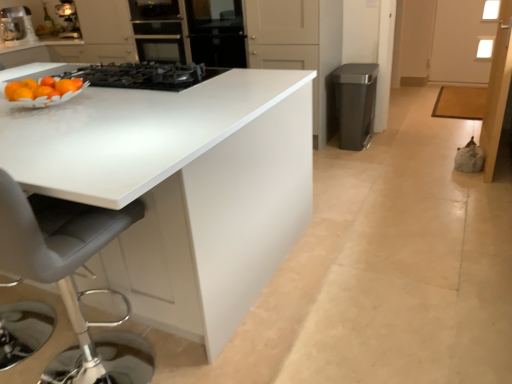
Locate an element on the screen. black matte gas stove at upper center is located at coordinates (145, 75).

Describe the element at coordinates (17, 26) in the screenshot. The height and width of the screenshot is (384, 512). I see `metallic silver coffee maker at upper left` at that location.

In order to face satin metallic trash can at right, should I rotate leftwards or rightwards?

You should rotate right by 13.041 degrees.

Find the location of a particular element. white glossy table at center is located at coordinates (180, 188).

The width and height of the screenshot is (512, 384). What do you see at coordinates (158, 30) in the screenshot?
I see `black glass oven at center` at bounding box center [158, 30].

Find the location of `gray leather swivel chair at left`. gray leather swivel chair at left is located at coordinates (68, 268).

Identify the location of black matte gas stove at upper center. This screenshot has height=384, width=512. (145, 75).

Considering the relative sizes of satin metallic trash can at right and gray leather swivel chair at left in the image provided, is satin metallic trash can at right thinner than gray leather swivel chair at left?

Yes, satin metallic trash can at right is thinner than gray leather swivel chair at left.

Is satin metallic trash can at right oriented away from gray leather swivel chair at left?

No, satin metallic trash can at right's orientation is not away from gray leather swivel chair at left.

Is satin metallic trash can at right next to gray leather swivel chair at left and touching it?

satin metallic trash can at right and gray leather swivel chair at left are clearly separated.

From a real-world perspective, who is located lower, satin metallic trash can at right or gray leather swivel chair at left?

satin metallic trash can at right.

From a real-world perspective, who is located lower, gray leather swivel chair at left or metallic silver coffee maker at upper left?

gray leather swivel chair at left.

Considering the positions of point (141, 373) and point (30, 39), is point (141, 373) closer or farther from the camera than point (30, 39)?

Clearly, point (141, 373) is closer to the camera than point (30, 39).

Based on the photo, would you say gray leather swivel chair at left is to the left or to the right of metallic silver coffee maker at upper left in the picture?

gray leather swivel chair at left is positioned on metallic silver coffee maker at upper left's right side.

Is the surface of gray leather swivel chair at left in direct contact with metallic silver coffee maker at upper left?

No, gray leather swivel chair at left is not making contact with metallic silver coffee maker at upper left.

From a real-world perspective, is black matte gas stove at upper center located beneath white glossy table at center?

No, from a real-world perspective, black matte gas stove at upper center is not under white glossy table at center.

Is black matte gas stove at upper center at the right side of white glossy table at center?

Indeed, black matte gas stove at upper center is positioned on the right side of white glossy table at center.

Consider the image. Is the surface of black matte gas stove at upper center in direct contact with white glossy table at center?

black matte gas stove at upper center is not next to white glossy table at center, and they're not touching.

Are black matte gas stove at upper center and satin metallic trash can at right far apart?

Yes, black matte gas stove at upper center and satin metallic trash can at right are quite far apart.

Is the depth of black matte gas stove at upper center greater than that of satin metallic trash can at right?

No, black matte gas stove at upper center is in front of satin metallic trash can at right.

How different are the orientations of black matte gas stove at upper center and satin metallic trash can at right in degrees?

88.7 degrees.

From the image's perspective, relative to satin metallic trash can at right, is black matte gas stove at upper center above or below?

Clearly, from the image's perspective, black matte gas stove at upper center is below satin metallic trash can at right.

Identify the location of oven above the satin metallic trash can at right (from a real-world perspective). (158, 30).

Could black glass oven at center be considered to be inside satin metallic trash can at right?

Actually, black glass oven at center is outside satin metallic trash can at right.

From a real-world perspective, is satin metallic trash can at right beneath black glass oven at center?

Yes, from a real-world perspective, satin metallic trash can at right is under black glass oven at center.

In the scene shown: Looking at their sizes, would you say satin metallic trash can at right is wider or thinner than black glass oven at center?

In the image, satin metallic trash can at right appears to be more narrow than black glass oven at center.

From the image's perspective, between gray leather swivel chair at left and black matte gas stove at upper center, which one is located above?

black matte gas stove at upper center.

From a real-world perspective, is gray leather swivel chair at left on black matte gas stove at upper center?

No, from a real-world perspective, gray leather swivel chair at left is not over black matte gas stove at upper center

What's the angular difference between gray leather swivel chair at left and black matte gas stove at upper center's facing directions?

2.3 degrees.

Identify the location of oven above the gray leather swivel chair at left (from the image's perspective). (158, 30).

Does black glass oven at center have a greater height compared to gray leather swivel chair at left?

No.

Can you confirm if black glass oven at center is wider than gray leather swivel chair at left?

In fact, black glass oven at center might be narrower than gray leather swivel chair at left.

Is black glass oven at center inside or outside of gray leather swivel chair at left?

black glass oven at center is spatially situated outside gray leather swivel chair at left.

Where is `appliance below the gray leather swivel chair at left (from a real-world perspective)`? Image resolution: width=512 pixels, height=384 pixels. appliance below the gray leather swivel chair at left (from a real-world perspective) is located at coordinates (355, 103).

I want to click on home appliance behind the gray leather swivel chair at left, so coord(17,26).

When comparing their distances from black matte gas stove at upper center, does metallic silver coffee maker at upper left or gray leather swivel chair at left seem closer?

gray leather swivel chair at left.

Based on their spatial positions, is satin metallic trash can at right or gray leather swivel chair at left closer to metallic silver coffee maker at upper left?

Based on the image, satin metallic trash can at right appears to be nearer to metallic silver coffee maker at upper left.

Considering their positions, is satin metallic trash can at right positioned further to white glossy table at center than gray leather swivel chair at left?

satin metallic trash can at right is positioned further to the anchor white glossy table at center.

Considering their positions, is metallic silver coffee maker at upper left positioned further to gray leather swivel chair at left than satin metallic trash can at right?

metallic silver coffee maker at upper left is further to gray leather swivel chair at left.

From the image, which object appears to be nearer to satin metallic trash can at right, black matte gas stove at upper center or gray leather swivel chair at left?

Among the two, black matte gas stove at upper center is located nearer to satin metallic trash can at right.

Which object lies nearer to the anchor point black matte gas stove at upper center, metallic silver coffee maker at upper left or black glass oven at center?

The object closer to black matte gas stove at upper center is black glass oven at center.

Looking at the image, which one is located further to gray leather swivel chair at left, white glossy table at center or black matte gas stove at upper center?

Among the two, black matte gas stove at upper center is located further to gray leather swivel chair at left.

Considering their positions, is gray leather swivel chair at left positioned closer to satin metallic trash can at right than metallic silver coffee maker at upper left?

gray leather swivel chair at left is closer to satin metallic trash can at right.

At what (x,y) coordinates should I click in order to perform the action: click on gas stove between white glossy table at center and black glass oven at center from front to back. Please return your answer as a coordinate pair (x, y). Looking at the image, I should click on (145, 75).

Locate an element on the screen. The width and height of the screenshot is (512, 384). gas stove located between gray leather swivel chair at left and satin metallic trash can at right in the depth direction is located at coordinates (145, 75).

Locate an element on the screen. appliance between gray leather swivel chair at left and metallic silver coffee maker at upper left along the z-axis is located at coordinates (355, 103).

Find the location of a particular element. oven between white glossy table at center and metallic silver coffee maker at upper left along the z-axis is located at coordinates (158, 30).